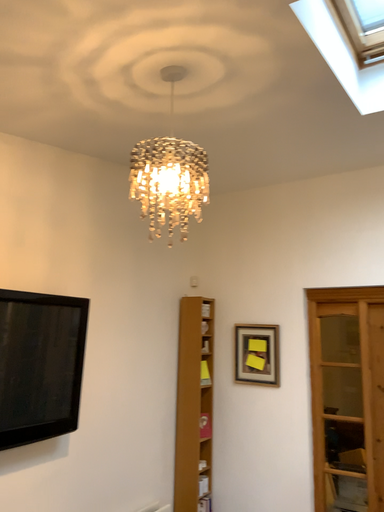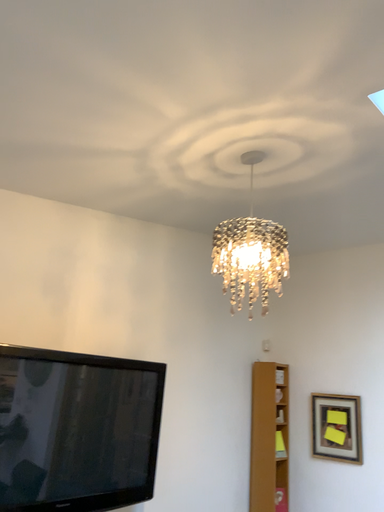
Question: Which way did the camera rotate in the video?

Choices:
 (A) rotated downward
 (B) rotated upward

Answer: (B)